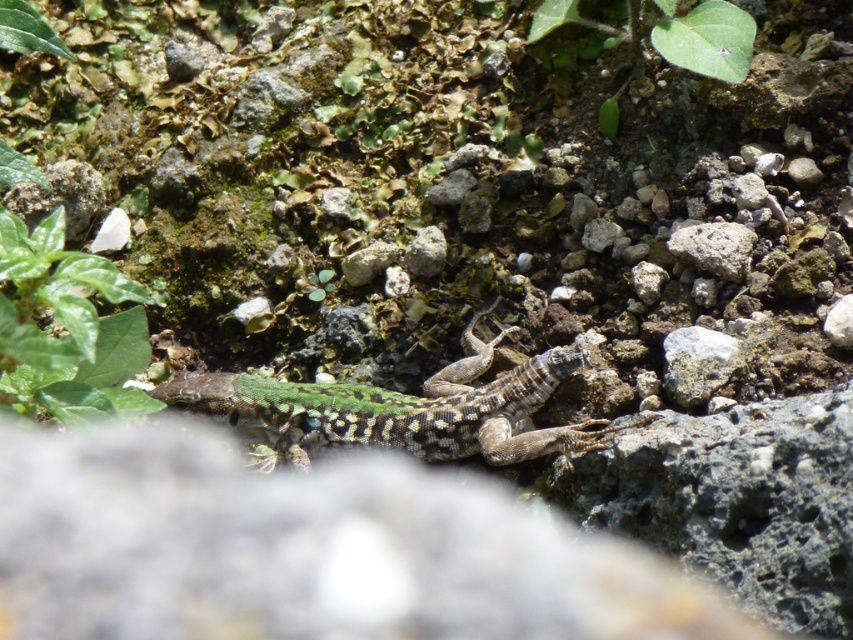
Question: Which point is farther to the camera?

Choices:
 (A) (84, 408)
 (B) (537, 20)
 (C) (187, 394)

Answer: (B)

Question: Which of the following is the farthest from the observer?

Choices:
 (A) (132, 337)
 (B) (741, 29)
 (C) (386, 419)

Answer: (C)

Question: Which object appears closest to the camera in this image?

Choices:
 (A) speckled green lizard at center
 (B) green leafy plant at left

Answer: (B)

Question: Does speckled green lizard at center have a smaller size compared to green leafy plant at upper center?

Choices:
 (A) yes
 (B) no

Answer: (B)

Question: Does speckled green lizard at center have a greater width compared to green leafy plant at upper center?

Choices:
 (A) no
 (B) yes

Answer: (B)

Question: Can you confirm if speckled green lizard at center is thinner than green leafy plant at upper center?

Choices:
 (A) yes
 (B) no

Answer: (B)